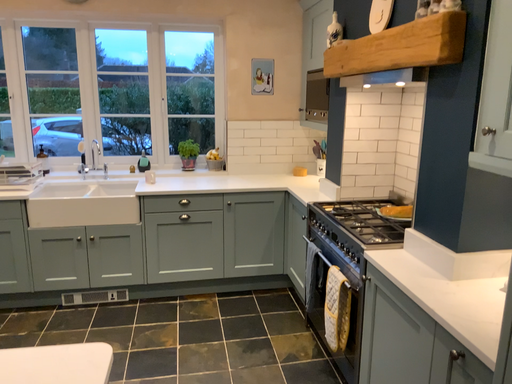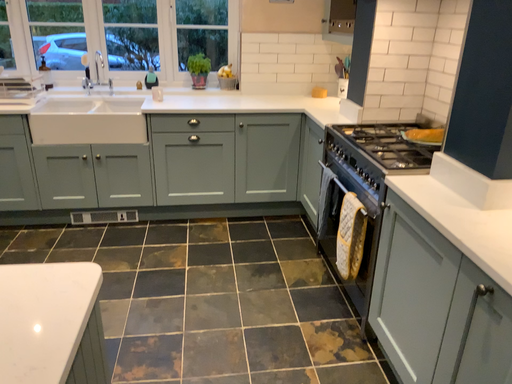
Question: Which way did the camera rotate in the video?

Choices:
 (A) rotated upward
 (B) rotated downward

Answer: (B)